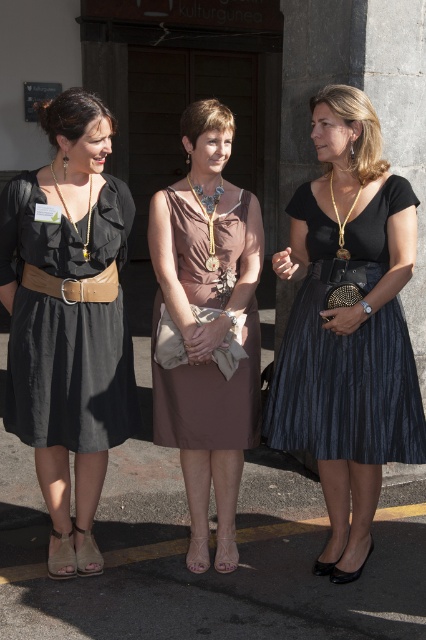
Based on the photo, who is more forward, (400, 230) or (109, 275)?

Positioned in front is point (400, 230).

Measure the distance between shiny black skirt at center and camera.

A distance of 9.36 feet exists between shiny black skirt at center and camera.

Where is `shiny black skirt at center`? The width and height of the screenshot is (426, 640). shiny black skirt at center is located at coordinates (348, 324).

Describe the element at coordinates (69, 320) in the screenshot. I see `matte black dress at left` at that location.

Does matte black dress at left have a greater width compared to matte brown dress at center?

Yes.

Where is `matte black dress at left`? Image resolution: width=426 pixels, height=640 pixels. matte black dress at left is located at coordinates (69, 320).

Measure the distance from matte brown dress at center to brown leather belt at center.

matte brown dress at center and brown leather belt at center are 18.12 inches apart.

Locate an element on the screen. The width and height of the screenshot is (426, 640). matte brown dress at center is located at coordinates (207, 326).